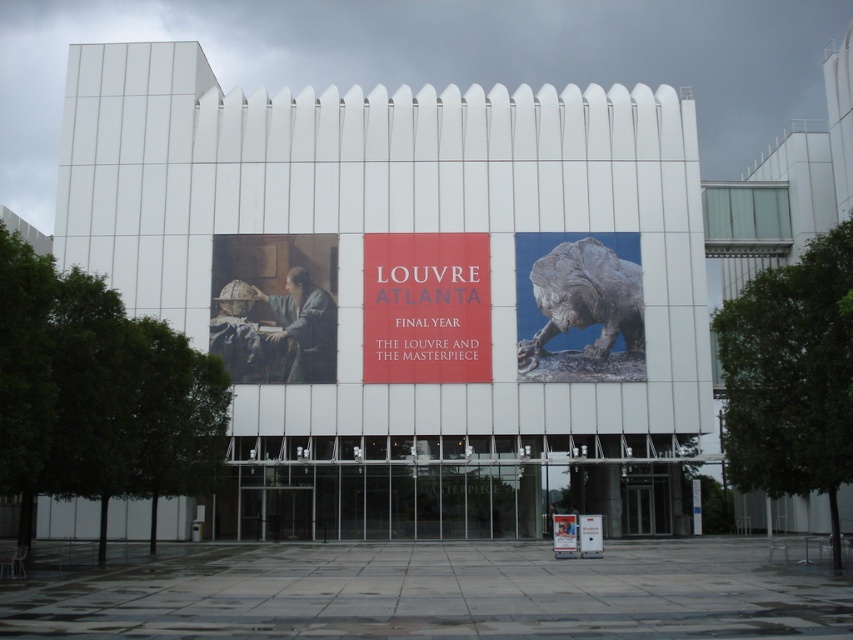
In the scene shown: Can you confirm if matte red sign at center is positioned to the left of bronze statue at right?

Indeed, matte red sign at center is positioned on the left side of bronze statue at right.

Can you confirm if matte red sign at center is smaller than bronze statue at right?

Yes, matte red sign at center is smaller than bronze statue at right.

Is point (419, 273) positioned after point (639, 269)?

No, (419, 273) is closer to viewer.

Locate an element on the screen. Image resolution: width=853 pixels, height=640 pixels. matte red sign at center is located at coordinates (426, 307).

Which of these two, matte red sign at center or matte white sign at center, stands shorter?

matte white sign at center

Measure the distance from matte red sign at center to matte white sign at center.

A distance of 13.89 meters exists between matte red sign at center and matte white sign at center.

Who is more forward, (451, 244) or (555, 518)?

Point (555, 518)

Find the location of `matte red sign at center`. matte red sign at center is located at coordinates (426, 307).

Who is positioned more to the left, bronze statue at right or matte white sign at center?

matte white sign at center

The image size is (853, 640). What are the coordinates of `bronze statue at right` in the screenshot? It's located at (578, 294).

At what (x,y) coordinates should I click in order to perform the action: click on bronze statue at right. Please return your answer as a coordinate pair (x, y). The width and height of the screenshot is (853, 640). Looking at the image, I should click on (578, 294).

Locate an element on the screen. Image resolution: width=853 pixels, height=640 pixels. bronze statue at right is located at coordinates (578, 294).